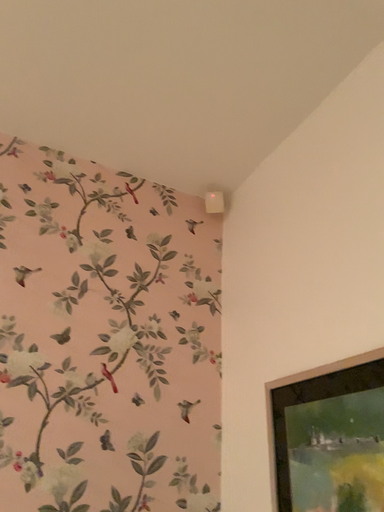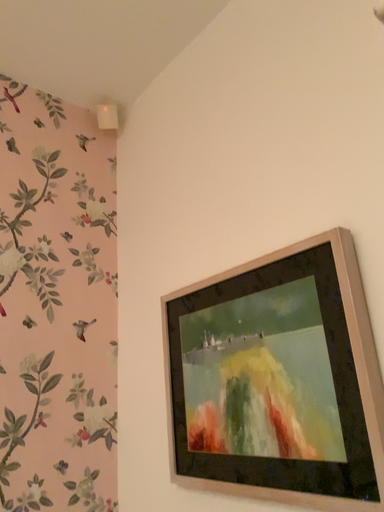
Question: How did the camera likely rotate when shooting the video?

Choices:
 (A) rotated upward
 (B) rotated downward

Answer: (B)